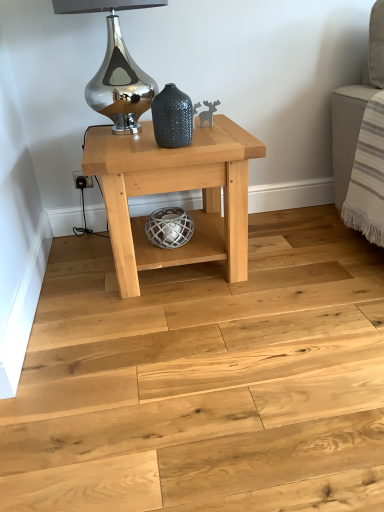
What are the coordinates of `vacant space positioned to the left of textured dark gray vase at center` in the screenshot? It's located at (128, 156).